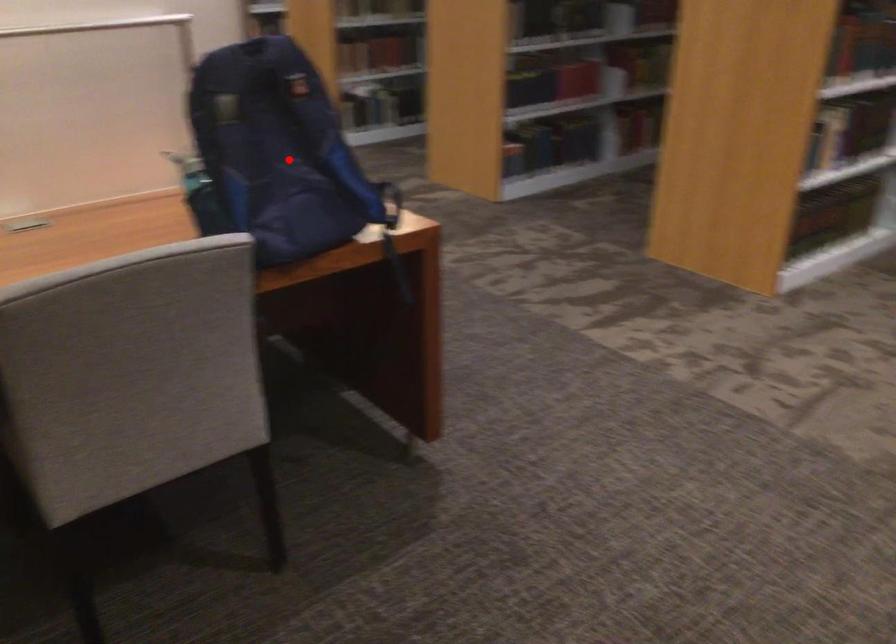
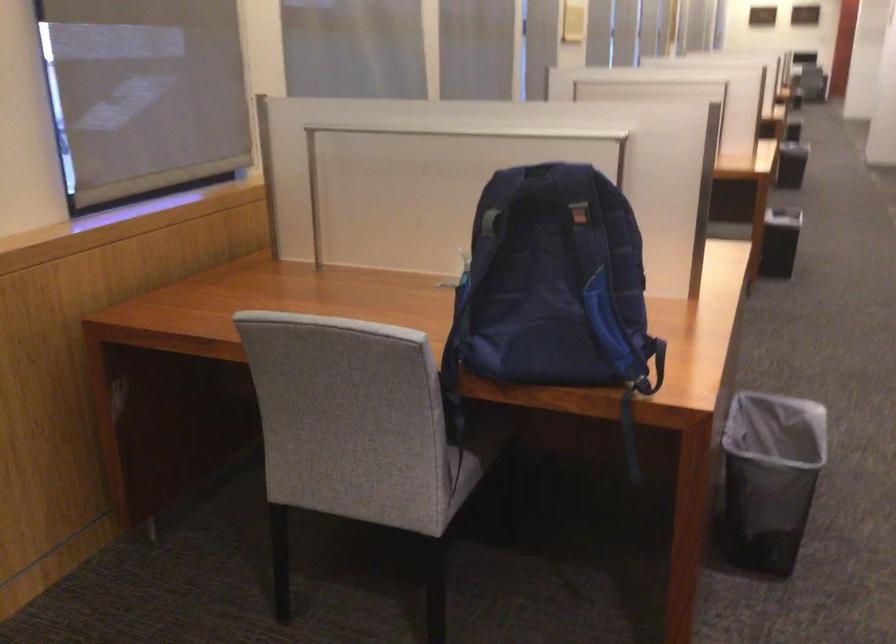
In the second image, find the point that corresponds to the highlighted location in the first image.

(552, 281)